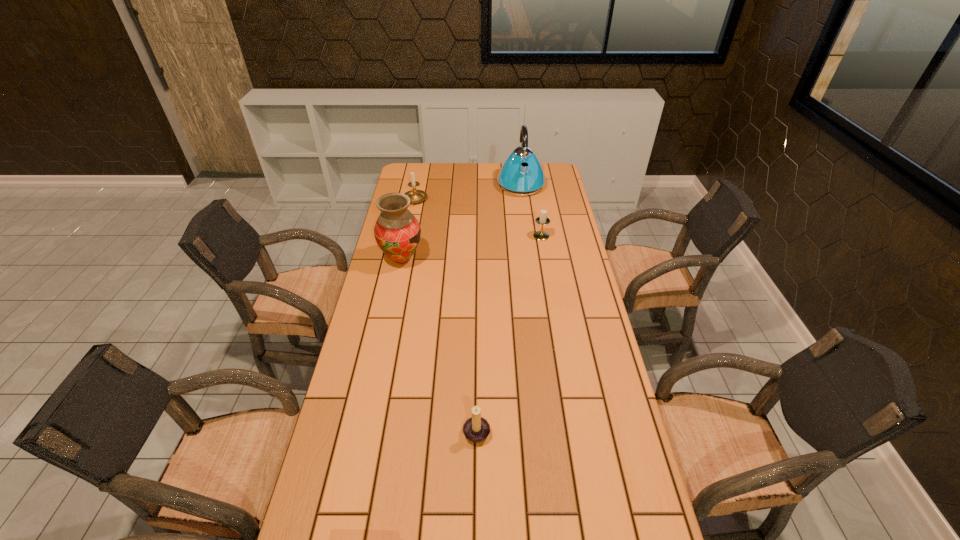
I want to click on blank region between the nearest candle holder and the farthest candle holder, so click(445, 315).

At what (x,y) coordinates should I click in order to perform the action: click on blank region between the vase and the kettle. Please return your answer as a coordinate pair (x, y). The height and width of the screenshot is (540, 960). Looking at the image, I should click on (461, 221).

This screenshot has width=960, height=540. Find the location of `vacant area that lies between the kettle and the third nearest object`. vacant area that lies between the kettle and the third nearest object is located at coordinates (531, 210).

Locate an element on the screen. free space between the leftmost candle holder and the second nearest candle holder is located at coordinates (478, 218).

Find the location of a particular element. vacant area that lies between the second candle holder from right to left and the second nearest candle holder is located at coordinates (509, 333).

Where is `vacant area that lies between the nearest candle holder and the farthest candle holder`? The width and height of the screenshot is (960, 540). vacant area that lies between the nearest candle holder and the farthest candle holder is located at coordinates (445, 315).

Identify the location of object that is the third closest to the leftmost candle holder. The width and height of the screenshot is (960, 540). (542, 220).

Find the location of a particular element. This screenshot has width=960, height=540. the fourth closest object relative to the third object from left to right is located at coordinates (521, 174).

The height and width of the screenshot is (540, 960). I want to click on candle holder that stands as the third closest to the vase, so click(476, 429).

Identify which candle holder is the closest to the third object from left to right. Please provide its 2D coordinates. Your answer should be formatted as a tuple, i.e. [(x, y)], where the tuple contains the x and y coordinates of a point satisfying the conditions above.

[(542, 220)]